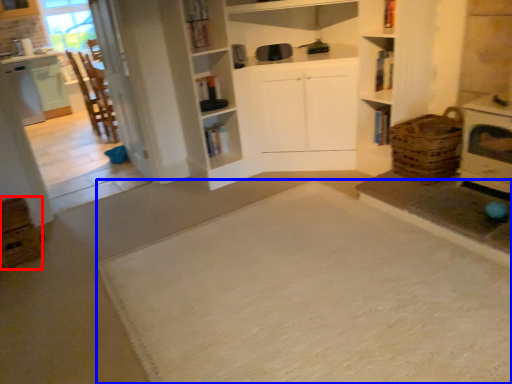
Question: Which object is further to the camera taking this photo, crate (highlighted by a red box) or doormat (highlighted by a blue box)?

Choices:
 (A) crate
 (B) doormat

Answer: (A)